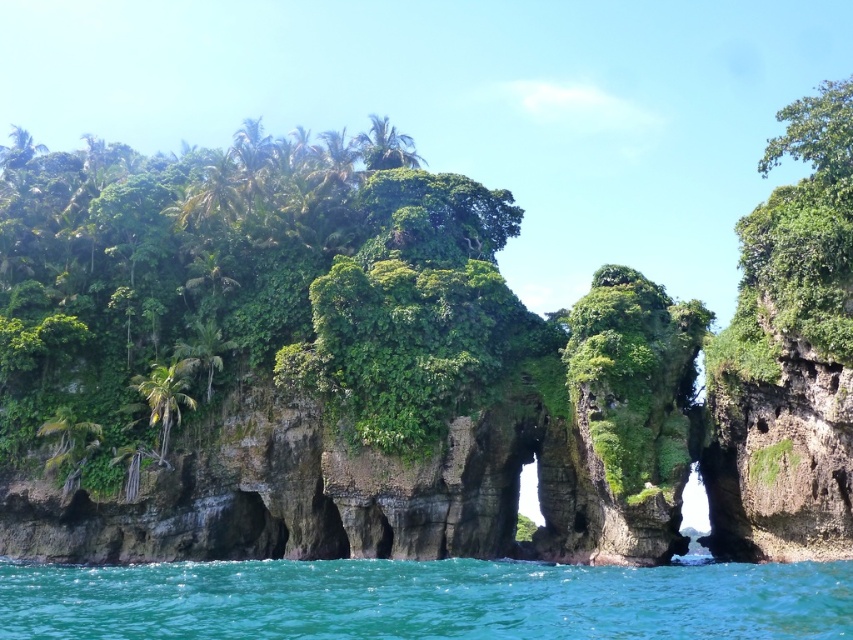
Question: Can you confirm if turquoise liquid at lower center is positioned to the right of green leafy palm tree at left?

Choices:
 (A) no
 (B) yes

Answer: (B)

Question: Which point is closer to the camera?

Choices:
 (A) (647, 570)
 (B) (142, 390)

Answer: (A)

Question: Which point is closer to the camera taking this photo?

Choices:
 (A) (241, 566)
 (B) (169, 406)

Answer: (A)

Question: Where is turquoise liquid at lower center located in relation to green leafy palm tree at left in the image?

Choices:
 (A) right
 (B) left

Answer: (A)

Question: Is turquoise liquid at lower center to the left of green leafy palm tree at left from the viewer's perspective?

Choices:
 (A) no
 (B) yes

Answer: (A)

Question: Which object is closer to the camera taking this photo?

Choices:
 (A) turquoise liquid at lower center
 (B) green leafy palm tree at left

Answer: (A)